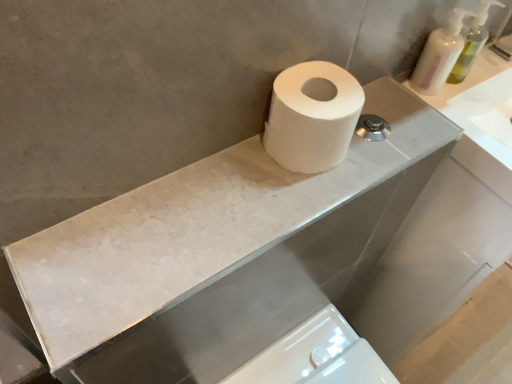
This screenshot has height=384, width=512. What are the coordinates of `free space to the left of white matte toilet paper at center` in the screenshot? It's located at (206, 174).